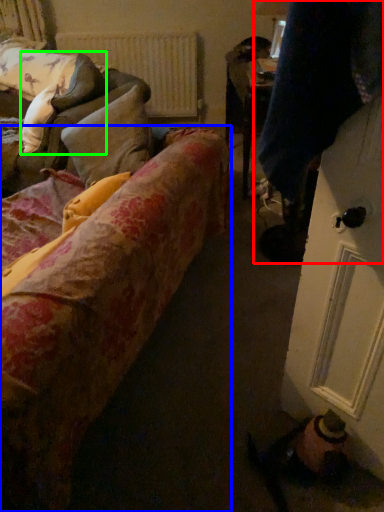
Question: Estimate the real-world distances between objects in this image. Which object is farther from couple (highlighted by a red box), studio couch (highlighted by a blue box) or pillow (highlighted by a green box)?

Choices:
 (A) studio couch
 (B) pillow

Answer: (B)